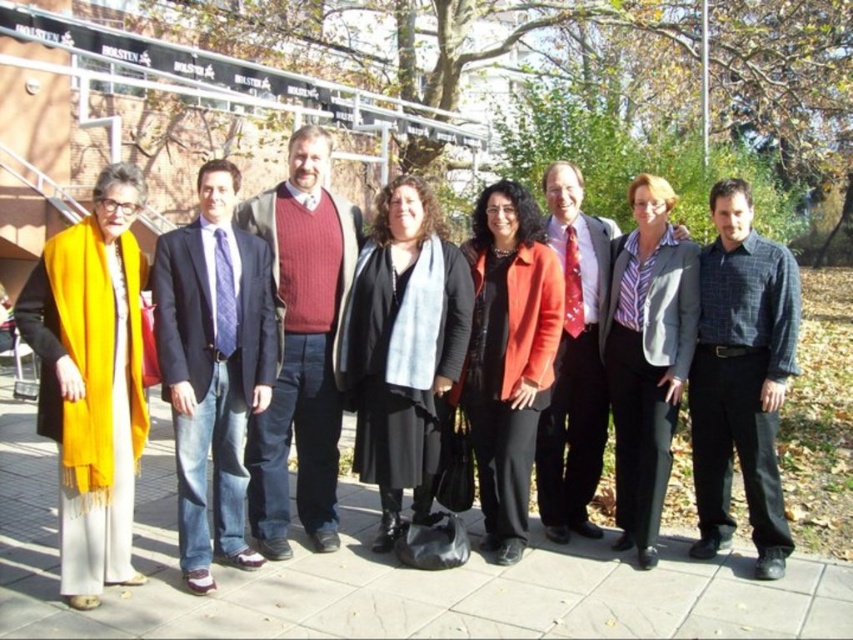
Does knitted sweater at center have a smaller size compared to gray blazer at center?

No.

Does point (296, 321) come behind point (691, 296)?

Yes, it is.

Where is `knitted sweater at center`? This screenshot has height=640, width=853. knitted sweater at center is located at coordinates (300, 346).

Is point (733, 394) positioned behind point (543, 404)?

That is False.

Between checkered shirt at center and matte red jacket at center, which one is positioned higher?

matte red jacket at center

I want to click on checkered shirt at center, so click(741, 378).

The height and width of the screenshot is (640, 853). Identify the location of checkered shirt at center. click(x=741, y=378).

Is point (386, 465) positioned after point (715, 506)?

No, (386, 465) is closer to viewer.

The image size is (853, 640). I want to click on black matte coat at center, so click(x=403, y=348).